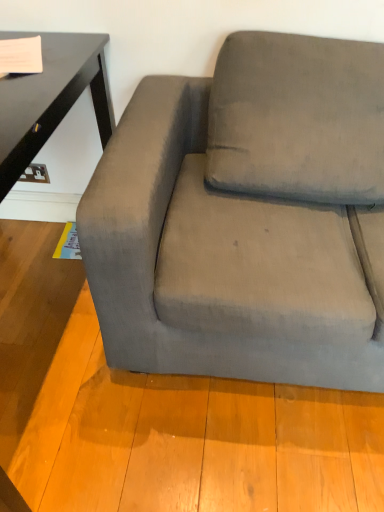
Question: Based on their sizes in the image, would you say velvet gray couch at center is bigger or smaller than suede-like gray pillow at upper right?

Choices:
 (A) small
 (B) big

Answer: (B)

Question: Relative to suede-like gray pillow at upper right, is velvet gray couch at center in front or behind?

Choices:
 (A) front
 (B) behind

Answer: (A)

Question: Considering the positions of velvet gray couch at center and suede-like gray pillow at upper right in the image, is velvet gray couch at center wider or thinner than suede-like gray pillow at upper right?

Choices:
 (A) thin
 (B) wide

Answer: (B)

Question: Relative to velvet gray couch at center, is suede-like gray pillow at upper right in front or behind?

Choices:
 (A) behind
 (B) front

Answer: (A)

Question: From the image's perspective, is suede-like gray pillow at upper right located above or below velvet gray couch at center?

Choices:
 (A) below
 (B) above

Answer: (B)

Question: Is suede-like gray pillow at upper right taller or shorter than velvet gray couch at center?

Choices:
 (A) short
 (B) tall

Answer: (A)

Question: Based on their sizes in the image, would you say suede-like gray pillow at upper right is bigger or smaller than velvet gray couch at center?

Choices:
 (A) big
 (B) small

Answer: (B)